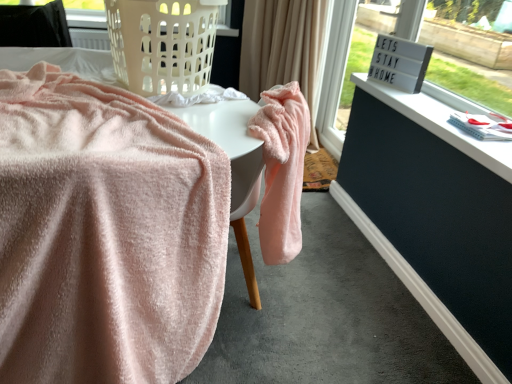
Locate an element on the screen. blank space above white matte window sill at upper right (from a real-world perspective) is located at coordinates (443, 119).